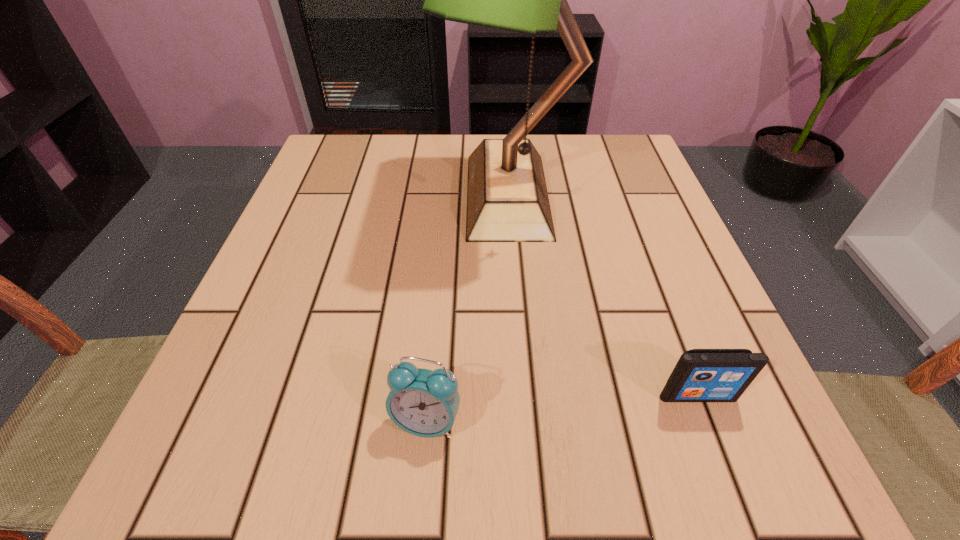
I want to click on table lamp, so click(507, 200).

I want to click on the farthest object, so click(x=507, y=200).

The width and height of the screenshot is (960, 540). What are the coordinates of `alarm clock` in the screenshot? It's located at (422, 402).

Identify the location of the rightmost object. Image resolution: width=960 pixels, height=540 pixels. (701, 375).

Image resolution: width=960 pixels, height=540 pixels. I want to click on iPod, so click(x=701, y=375).

I want to click on free space located on the metallic stand of the tallest object, so click(300, 195).

You are a GUI agent. You are given a task and a screenshot of the screen. Output one action in this format:
    pyautogui.click(x=<x>, y=<y>)
    Task: Click on the free location located on the metallic stand of the tallest object
    The height and width of the screenshot is (540, 960).
    Given the screenshot: What is the action you would take?
    pyautogui.click(x=329, y=195)

Where is `vacant area situated 0.130m on the metallic stand of the tallest object`? This screenshot has height=540, width=960. vacant area situated 0.130m on the metallic stand of the tallest object is located at coordinates (382, 195).

The width and height of the screenshot is (960, 540). What are the coordinates of `free space located on the front screen of the iPod` in the screenshot? It's located at (727, 472).

The image size is (960, 540). Identify the location of object that is at the far edge. (507, 200).